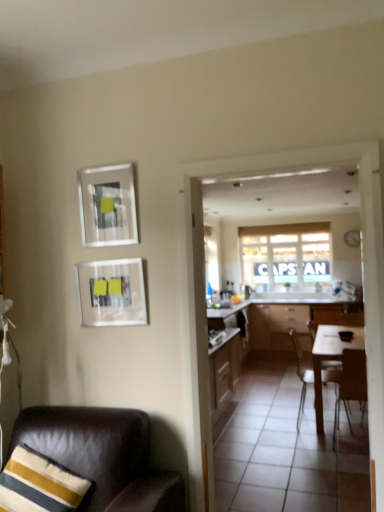
Question: From the image's perspective, is matte glass picture frame at upper left, marked as the second picture frame in a bottom-to-top arrangement, over white fabric window at center?

Choices:
 (A) no
 (B) yes

Answer: (B)

Question: Is matte glass picture frame at upper left, marked as the second picture frame in a bottom-to-top arrangement, taller than white fabric window at center?

Choices:
 (A) no
 (B) yes

Answer: (A)

Question: Does matte glass picture frame at upper left, marked as the second picture frame in a bottom-to-top arrangement, have a lesser height compared to white fabric window at center?

Choices:
 (A) no
 (B) yes

Answer: (B)

Question: From the image's perspective, does matte glass picture frame at upper left, marked as the second picture frame in a bottom-to-top arrangement, appear lower than white fabric window at center?

Choices:
 (A) no
 (B) yes

Answer: (A)

Question: Are matte glass picture frame at upper left, marked as the second picture frame in a bottom-to-top arrangement, and white fabric window at center making contact?

Choices:
 (A) yes
 (B) no

Answer: (B)

Question: Is white glossy tile at center to the left or to the right of white glossy countertop at center in the image?

Choices:
 (A) left
 (B) right

Answer: (B)

Question: From a real-world perspective, is white glossy tile at center physically located above or below white glossy countertop at center?

Choices:
 (A) above
 (B) below

Answer: (B)

Question: Considering the positions of white glossy tile at center and white glossy countertop at center in the image, is white glossy tile at center taller or shorter than white glossy countertop at center?

Choices:
 (A) tall
 (B) short

Answer: (B)

Question: In terms of size, does white glossy tile at center appear bigger or smaller than white glossy countertop at center?

Choices:
 (A) small
 (B) big

Answer: (B)

Question: Is matte glass picture frame at upper left, acting as the first picture frame starting from the top, wider or thinner than matte glass picture frame at center-left, the 2th picture frame in the top-to-bottom sequence?

Choices:
 (A) wide
 (B) thin

Answer: (B)

Question: Does point (102, 238) appear closer or farther from the camera than point (137, 287)?

Choices:
 (A) closer
 (B) farther

Answer: (B)

Question: Would you say matte glass picture frame at upper left, acting as the first picture frame starting from the top, is to the left or to the right of matte glass picture frame at center-left, the 2th picture frame in the top-to-bottom sequence, in the picture?

Choices:
 (A) right
 (B) left

Answer: (B)

Question: Is matte glass picture frame at upper left, marked as the second picture frame in a bottom-to-top arrangement, bigger or smaller than matte glass picture frame at center-left, acting as the first picture frame starting from the bottom?

Choices:
 (A) big
 (B) small

Answer: (B)

Question: From the image's perspective, is brown wooden chair at right, the second chair positioned from the back, above or below wooden cabinets at center?

Choices:
 (A) above
 (B) below

Answer: (B)

Question: Considering the positions of brown wooden chair at right, acting as the first chair starting from the right, and wooden cabinets at center in the image, is brown wooden chair at right, acting as the first chair starting from the right, bigger or smaller than wooden cabinets at center?

Choices:
 (A) big
 (B) small

Answer: (B)